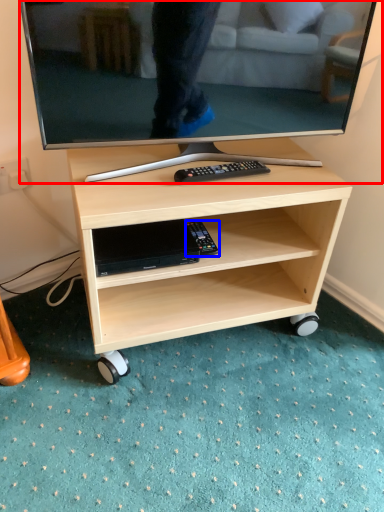
Question: Which of the following is the farthest to the observer, television (highlighted by a red box) or equipment (highlighted by a blue box)?

Choices:
 (A) television
 (B) equipment

Answer: (B)